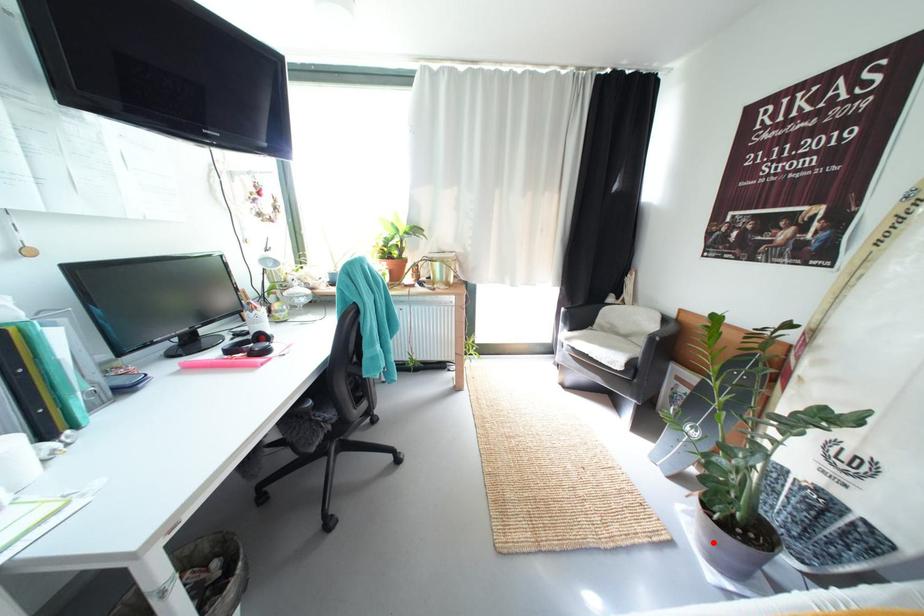
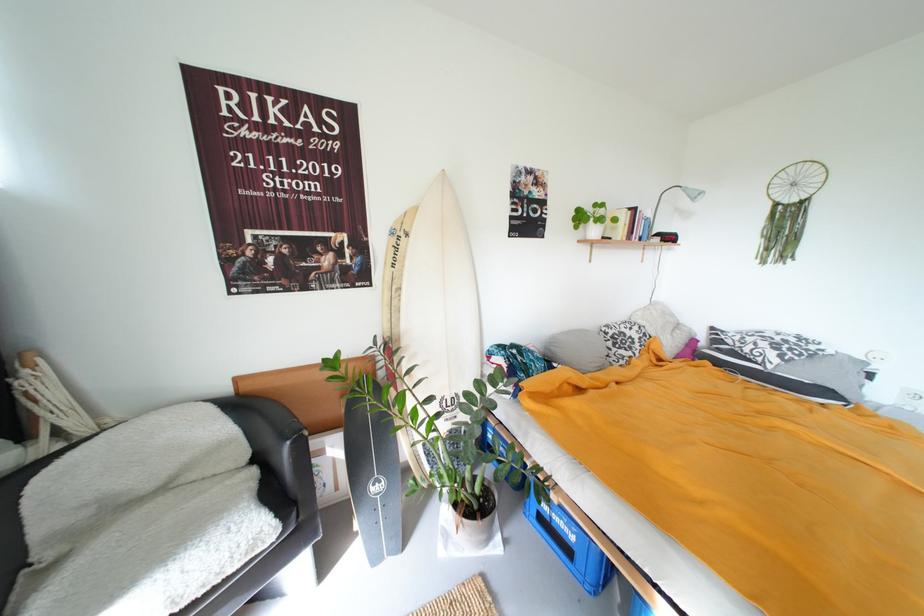
The point at the highlighted location is marked in the first image. Where is the corresponding point in the second image?

(492, 539)